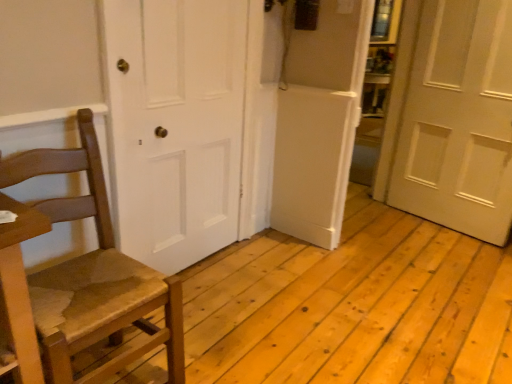
At what (x,y) coordinates should I click in order to perform the action: click on free space in front of white matte door at center, which is counted as the 1th door, starting from the left. Please return your answer as a coordinate pair (x, y). This screenshot has width=512, height=384. Looking at the image, I should click on (215, 314).